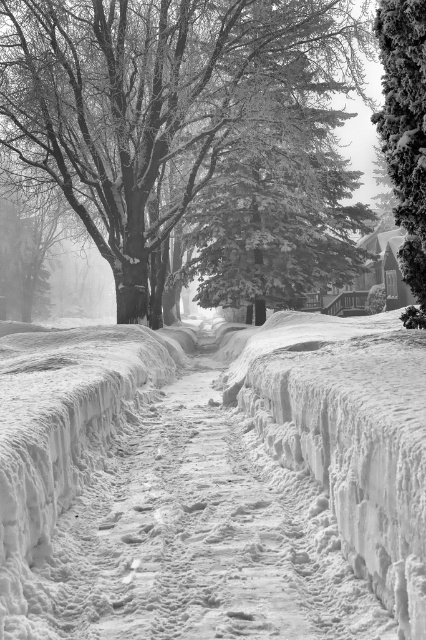
Based on the photo, you are standing at the starting point of the snow path in the winter scene. You want to walk towards the snow path in the distance. Which direction should you walk to avoid the snow covered tree at upper left located at point (158, 100)?

The snow covered tree at upper left is located at point (158, 100). To avoid it, you should walk towards the center of the snow path, which is clear of obstacles.